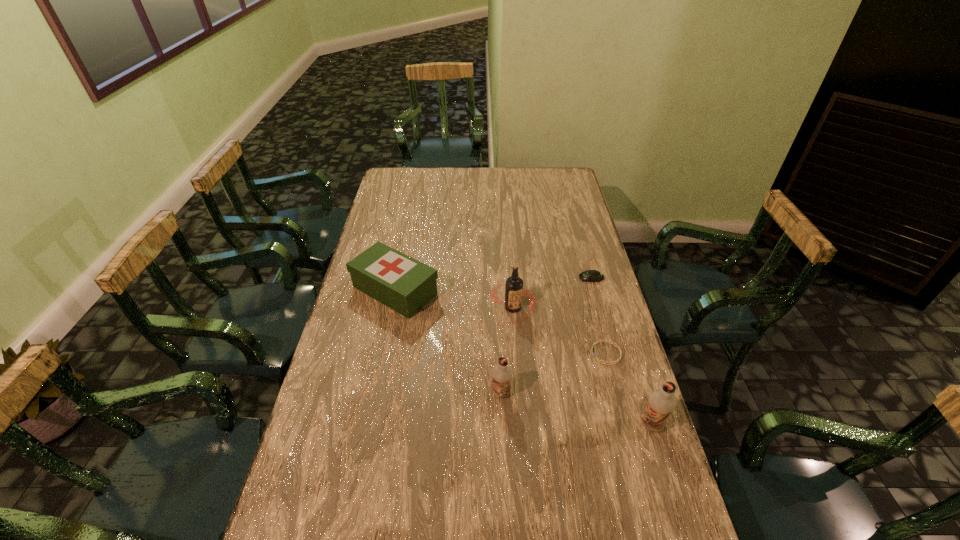
This screenshot has width=960, height=540. Identify the location of vacant space in between the leftmost object and the computer mouse. (493, 284).

In order to click on free space between the leftmost object and the nearest object in this screenshot , I will do `click(523, 357)`.

This screenshot has height=540, width=960. In order to click on free space between the root beer and the taller chocolate milk in this screenshot , I will do pyautogui.click(x=583, y=366).

At what (x,y) coordinates should I click in order to perform the action: click on unoccupied area between the bracelet and the fifth farthest object. Please return your answer as a coordinate pair (x, y). Image resolution: width=960 pixels, height=540 pixels. Looking at the image, I should click on (554, 373).

Locate an element on the screen. The width and height of the screenshot is (960, 540). free space between the second nearest object and the fifth tallest object is located at coordinates (546, 335).

The height and width of the screenshot is (540, 960). What are the coordinates of `vacant space that's between the nearer chocolate milk and the computer mouse` in the screenshot? It's located at (621, 351).

Image resolution: width=960 pixels, height=540 pixels. Identify the location of vacant space that is in between the nearest object and the computer mouse. (621, 351).

Where is `free point between the third tallest object and the root beer`? This screenshot has height=540, width=960. free point between the third tallest object and the root beer is located at coordinates point(507,350).

What are the coordinates of `object that is the third closest to the root beer` in the screenshot? It's located at (402, 283).

Select which object appears as the fifth closest to the fourth shortest object. Please provide its 2D coordinates. Your answer should be formatted as a tuple, i.e. [(x, y)], where the tuple contains the x and y coordinates of a point satisfying the conditions above.

[(590, 275)]